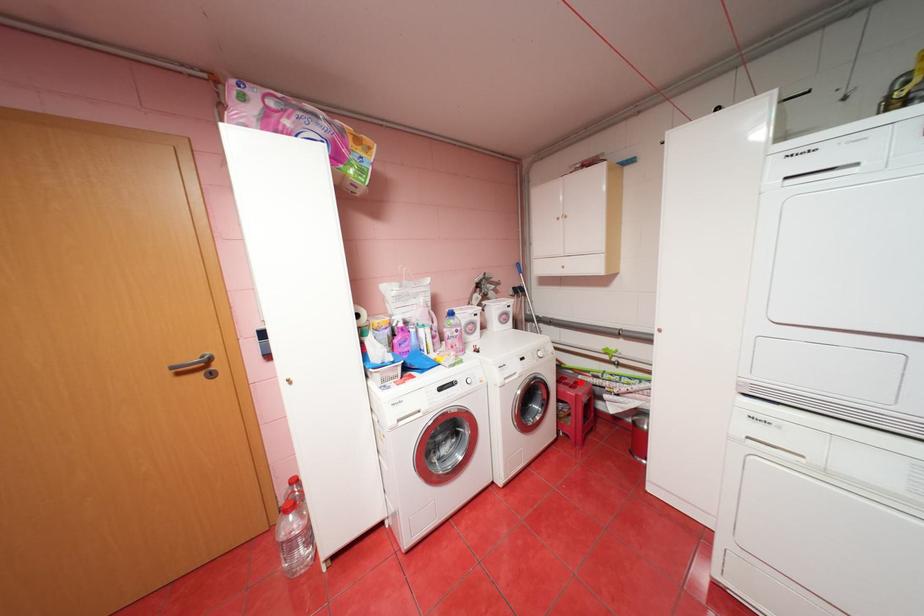
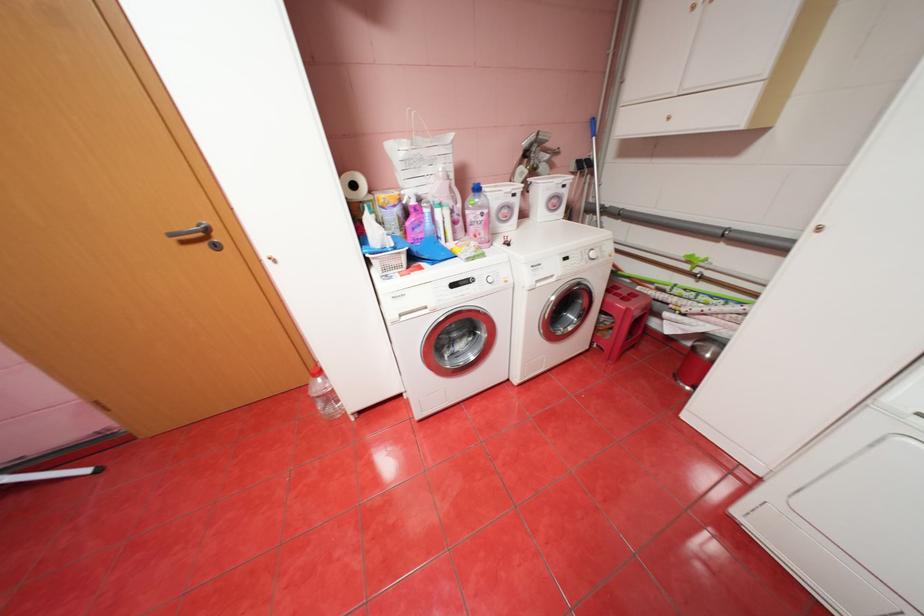
In the second image, find the point that corresponds to the highlighted location in the first image.

(634, 294)